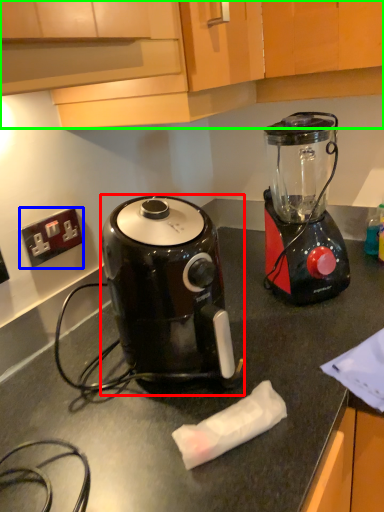
Question: Which object is the farthest from coffee maker (highlighted by a red box)? Choose among these: power outlet (highlighted by a blue box) or cabinetry (highlighted by a green box).

Choices:
 (A) power outlet
 (B) cabinetry

Answer: (A)